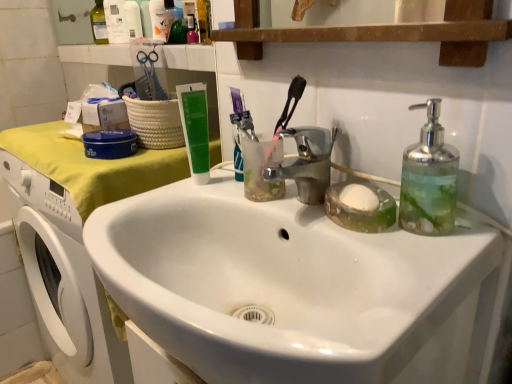
The width and height of the screenshot is (512, 384). Identify the location of unoccupied area in front of chrome metallic faucet at center. (354, 250).